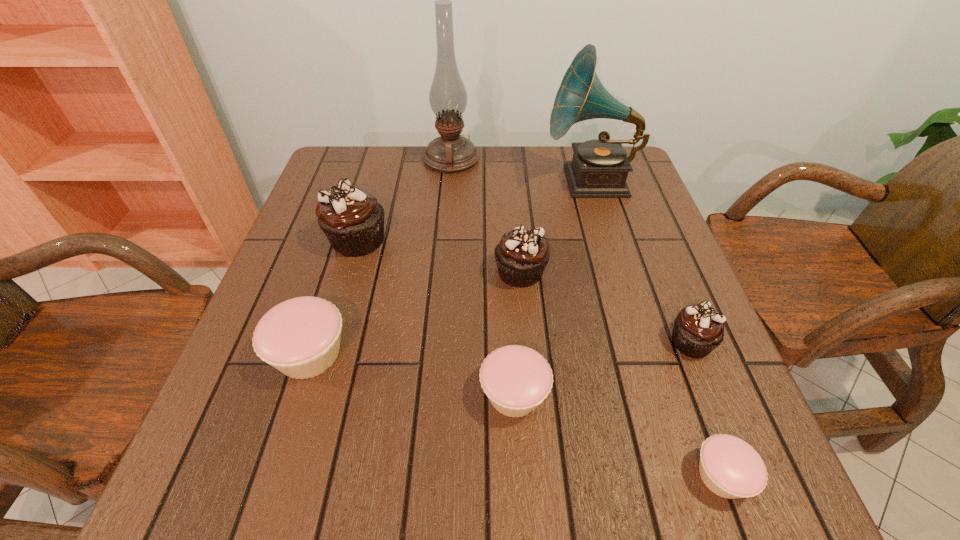
Find the location of a particular element. This screenshot has height=540, width=960. the seventh tallest object is located at coordinates (516, 379).

Locate an element on the screen. the second smallest pink cupcake is located at coordinates (516, 379).

You are a GUI agent. You are given a task and a screenshot of the screen. Output one action in this format:
    pyautogui.click(x=<x>, y=<y>)
    Task: Click on the smallest pink cupcake
    
    Given the screenshot: What is the action you would take?
    pyautogui.click(x=731, y=468)

The image size is (960, 540). I want to click on the nearest object, so click(x=731, y=468).

You are a GUI agent. You are given a task and a screenshot of the screen. Output one action in this format:
    pyautogui.click(x=<x>, y=<y>)
    Task: Click on the free space located on the left of the oil lamp
    
    Given the screenshot: What is the action you would take?
    pyautogui.click(x=361, y=160)

The width and height of the screenshot is (960, 540). I want to click on free space located 0.330m from the horn of the second tallest object, so click(423, 181).

At what (x,y) coordinates should I click in order to perform the action: click on free space located 0.370m from the horn of the second tallest object. Please return your answer as a coordinate pair (x, y). Looking at the image, I should click on (408, 181).

The image size is (960, 540). What are the coordinates of `vacant space located 0.250m from the horn of the second tallest object` in the screenshot? It's located at (452, 181).

I want to click on vacant space located 0.240m on the right of the leftmost brown cupcake, so click(492, 240).

The image size is (960, 540). Find the location of `blank space located 0.250m on the front of the second smallest brown cupcake`. blank space located 0.250m on the front of the second smallest brown cupcake is located at coordinates (532, 402).